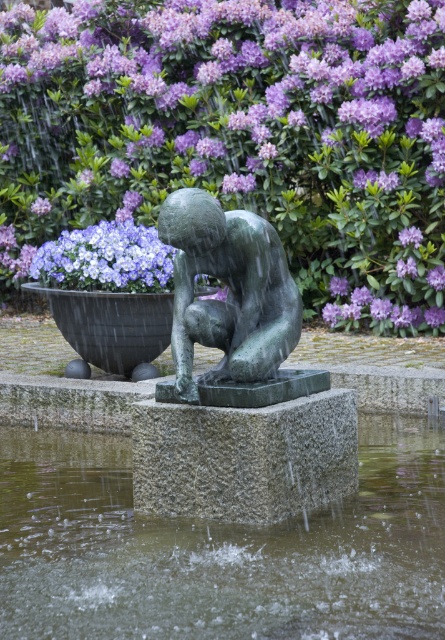
Can you confirm if clear water at fountain center is positioned above purple matte flower at upper left?

Incorrect, clear water at fountain center is not positioned above purple matte flower at upper left.

Does clear water at fountain center come behind purple matte flower at upper left?

No, clear water at fountain center is closer to the viewer.

Between point (360, 481) and point (35, 205), which one is positioned in front?

Point (360, 481) is more forward.

I want to click on clear water at fountain center, so click(218, 548).

Does green polished stone statue at center appear under purple matte flower at upper left?

Yes.

Is green polished stone statue at center wider than purple matte flower at upper left?

Correct, the width of green polished stone statue at center exceeds that of purple matte flower at upper left.

What do you see at coordinates (227, 291) in the screenshot? Image resolution: width=445 pixels, height=640 pixels. I see `green polished stone statue at center` at bounding box center [227, 291].

What are the coordinates of `green polished stone statue at center` in the screenshot? It's located at [x=227, y=291].

Between purple matte flower at upper center and purple matte flower at upper left, which one has less height?

With less height is purple matte flower at upper center.

Is point (408, 236) in front of point (41, 211)?

Yes, point (408, 236) is in front of point (41, 211).

The height and width of the screenshot is (640, 445). I want to click on purple matte flower at upper center, so click(x=411, y=236).